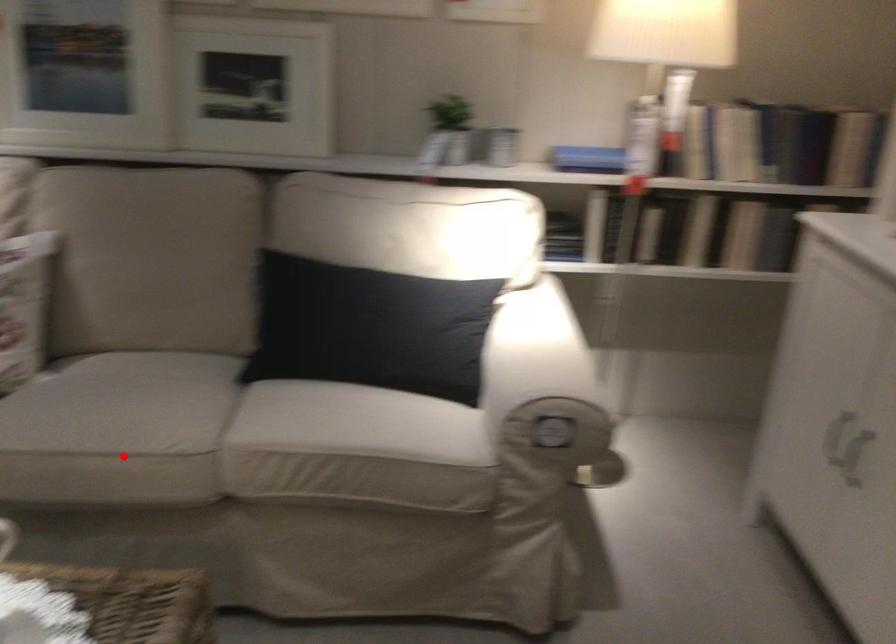
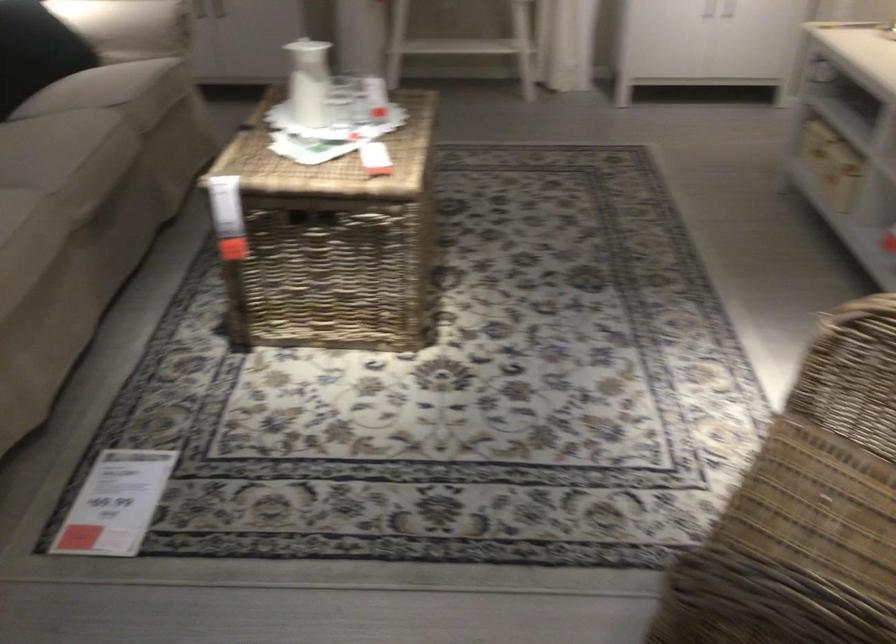
Question: A red point is marked in image1. In image2, is the corresponding 3D point closer to the camera or farther? Reply with the corresponding letter.

Choices:
 (A) The corresponding 3D point is closer.
 (B) The corresponding 3D point is farther.

Answer: (B)